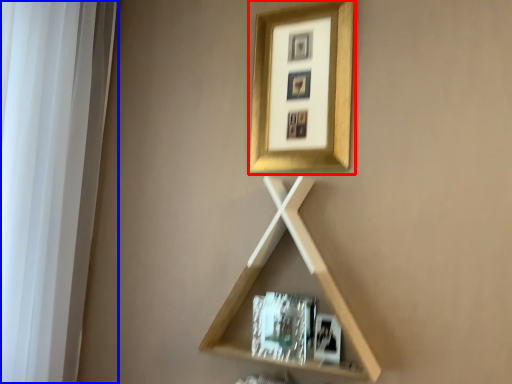
Question: Which of the following is the closest to the observer, picture frame (highlighted by a red box) or window frame (highlighted by a blue box)?

Choices:
 (A) picture frame
 (B) window frame

Answer: (B)